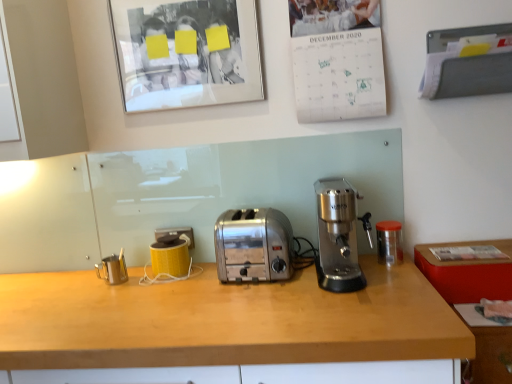
Identify the location of free space between satin silver coffee maker at center and transparent plastic container at right, arranged as the 1th appliance when viewed from the right. point(379,264).